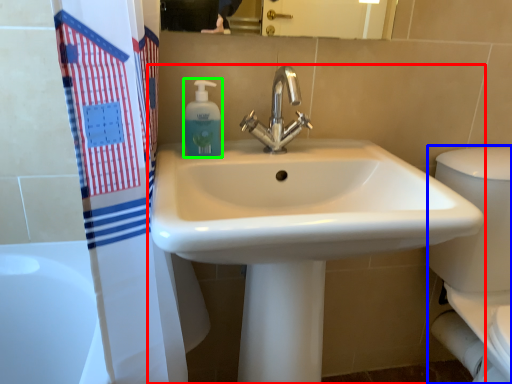
Question: Which is farther away from sink (highlighted by a red box)? porcelain (highlighted by a blue box) or soap dispenser (highlighted by a green box)?

Choices:
 (A) porcelain
 (B) soap dispenser

Answer: (A)